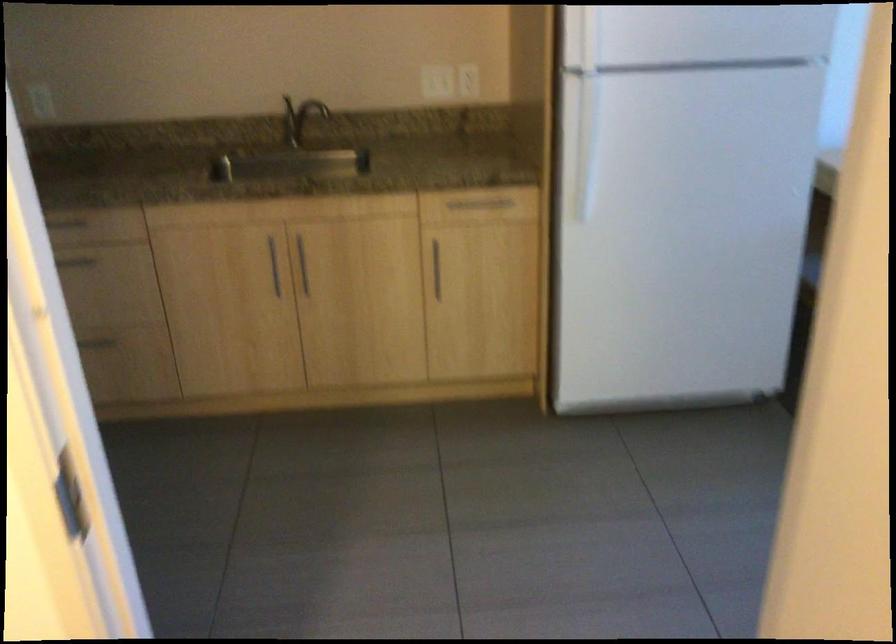
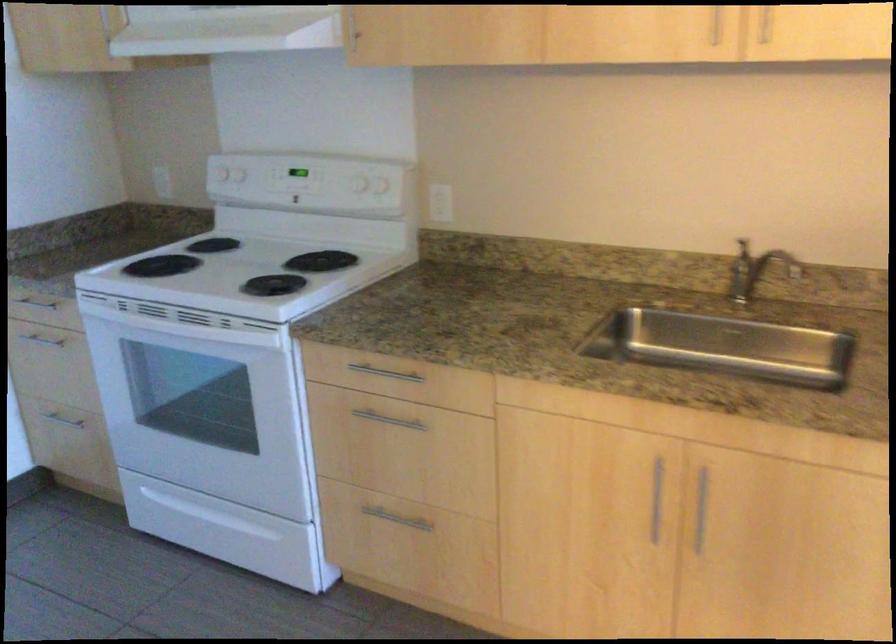
Question: The camera is either moving clockwise (left) or counter-clockwise (right) around the object. The first image is from the beginning of the video and the second image is from the end. Is the camera moving left or right when shooting the video?

Choices:
 (A) Left
 (B) Right

Answer: (B)